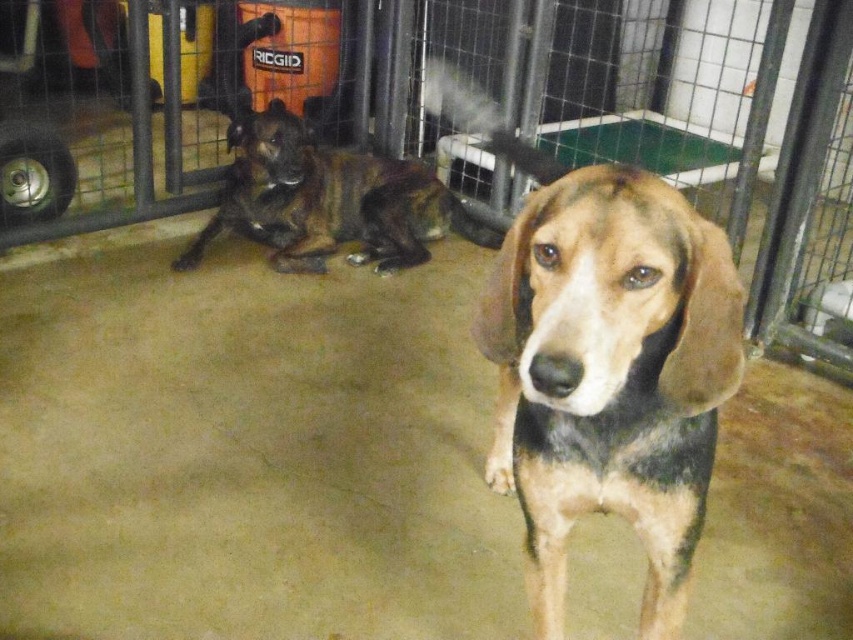
You are holding a 75 cm long pole and want to reach the point marked at point [610,228] from your current position. Can you reach it with the pole?

The distance between you and the point [610,228] is 78.90 centimeters. Since your pole is 75 cm long, you cannot reach it as the pole is shorter than the required distance.